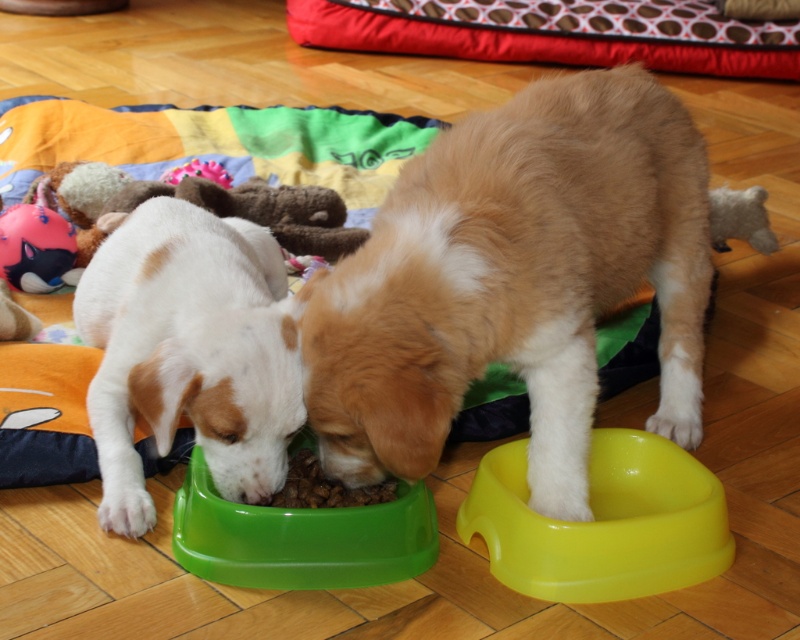
From the picture: You are a pet sitter who needs to choose a toy that fits in a 12 inch tall storage container. You see the golden fur dog at center and the pink fabric toy at upper center. Which toy can fit inside the container?

The pink fabric toy at upper center can fit inside the container because the golden fur dog at center is taller than it, and the container is only 12 inches tall.

You are standing in front of the two puppies and want to place a new toy between the two points marked as point [538,336] and point [226,179]. Which point should the toy be closer to so that it appears closer to you?

The toy should be placed closer to point [538,336] because it is closer to the viewer than point [226,179].

You are standing in the room where the golden fur dog at center is eating. If you want to place a new water bowl for the dog, where should you put it relative to the dog?

The golden fur dog at center is located at point (516, 282), so you should place the water bowl near that location to ensure the dog can easily access it.